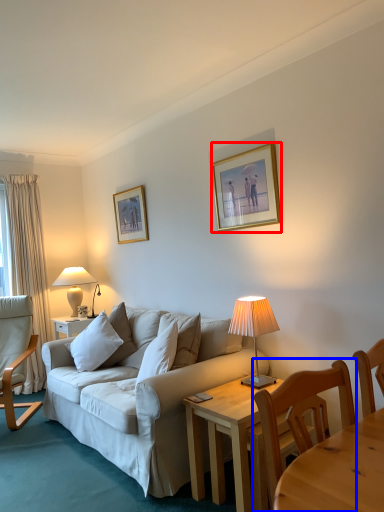
Question: Which point is closer to the camera, picture frame (highlighted by a red box) or chair (highlighted by a blue box)?

Choices:
 (A) picture frame
 (B) chair

Answer: (B)